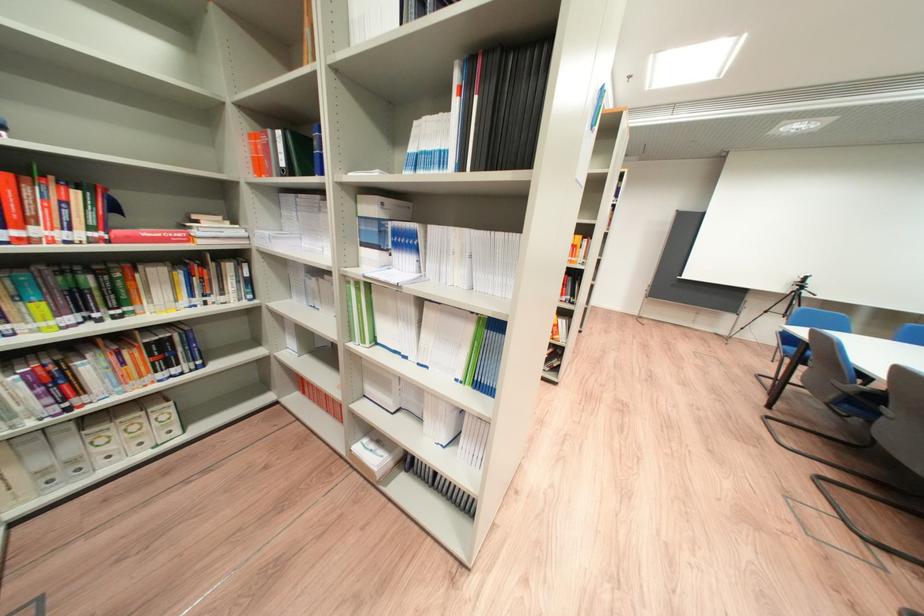
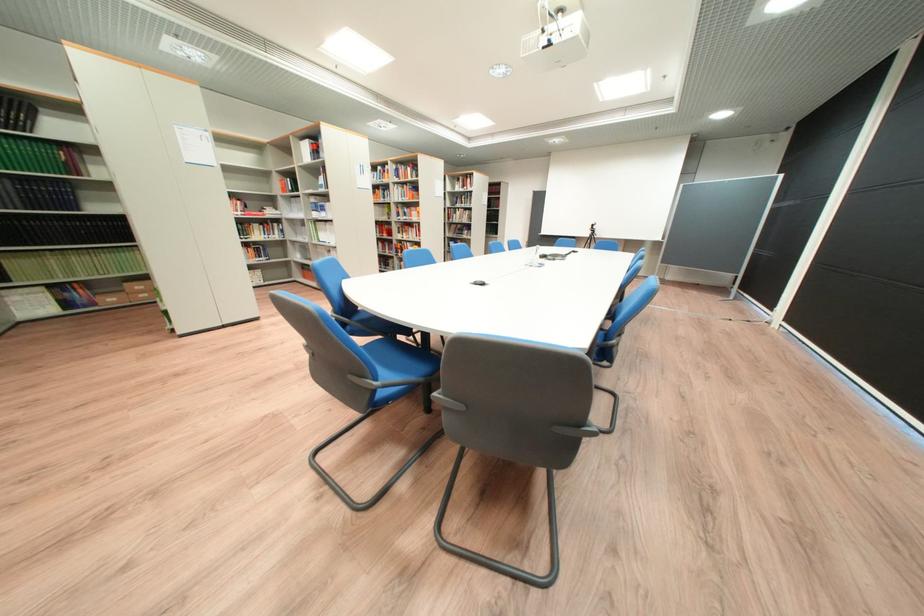
The images are taken continuously from a first-person perspective. In which direction are you moving?

The movement direction of the cameraman is right, backward.